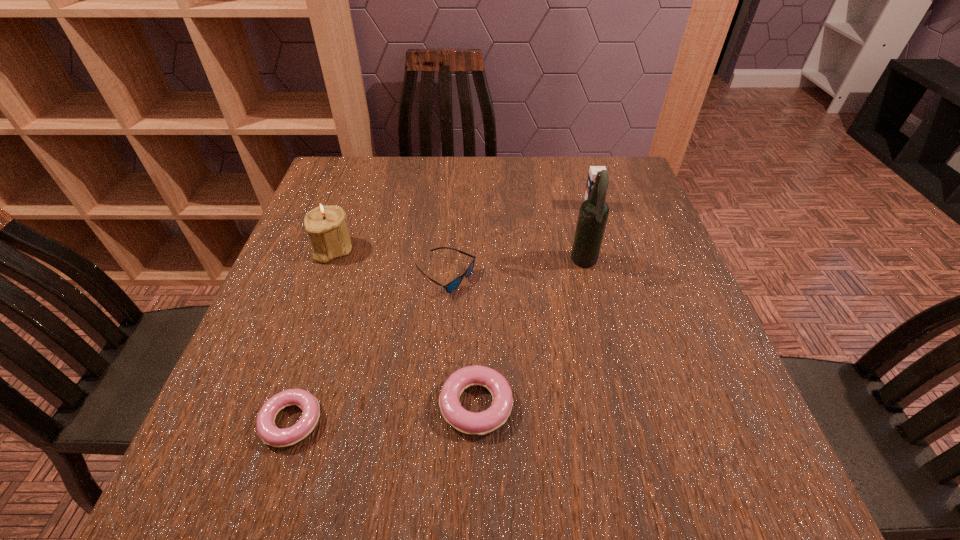
Please show where to add a doughnut on the right while keeping spacing even. Please provide its 2D coordinates. Your answer should be formatted as a tuple, i.e. [(x, y)], where the tuple contains the x and y coordinates of a point satisfying the conditions above.

[(651, 389)]